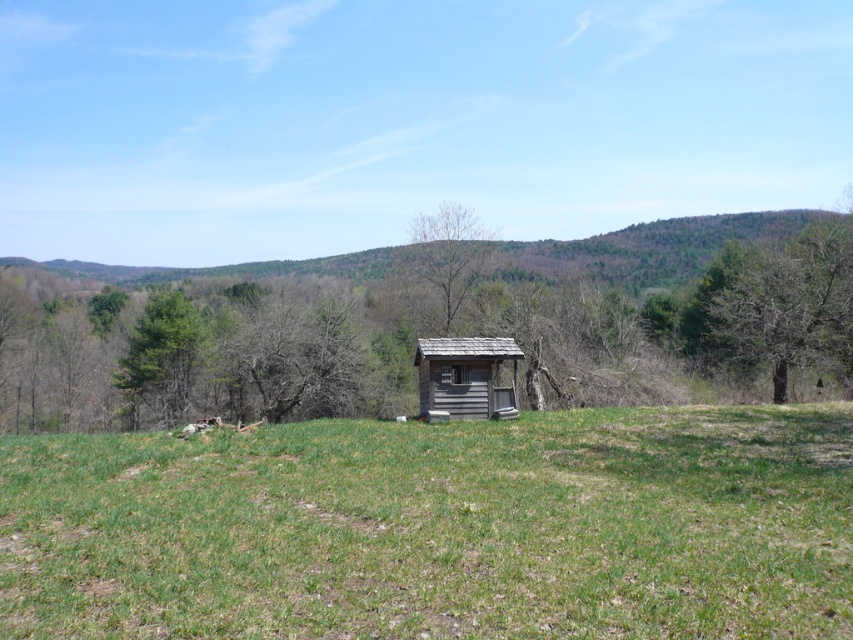
This screenshot has height=640, width=853. What do you see at coordinates (438, 529) in the screenshot?
I see `green grassy field at center` at bounding box center [438, 529].

The width and height of the screenshot is (853, 640). I want to click on green grassy field at center, so click(438, 529).

Who is more distant from viewer, (148, 564) or (439, 273)?

The point (439, 273) is more distant.

The image size is (853, 640). I want to click on green grassy field at center, so click(438, 529).

How distant is green leafy tree at right from weathered wood hut at center?

A distance of 20.75 meters exists between green leafy tree at right and weathered wood hut at center.

Can you confirm if green leafy tree at right is positioned to the right of weathered wood hut at center?

Indeed, green leafy tree at right is positioned on the right side of weathered wood hut at center.

What do you see at coordinates (785, 305) in the screenshot?
I see `green leafy tree at right` at bounding box center [785, 305].

Identify the location of green leafy tree at right. This screenshot has height=640, width=853. (785, 305).

Which of these two, green leafy tree at right or bare wood tree at center, stands taller?

bare wood tree at center is taller.

Which is below, green leafy tree at right or bare wood tree at center?

green leafy tree at right is below.

You are a GUI agent. You are given a task and a screenshot of the screen. Output one action in this format:
    pyautogui.click(x=<x>, y=<y>)
    Task: Click on the green leafy tree at right
    The width and height of the screenshot is (853, 640).
    Given the screenshot: What is the action you would take?
    click(x=785, y=305)